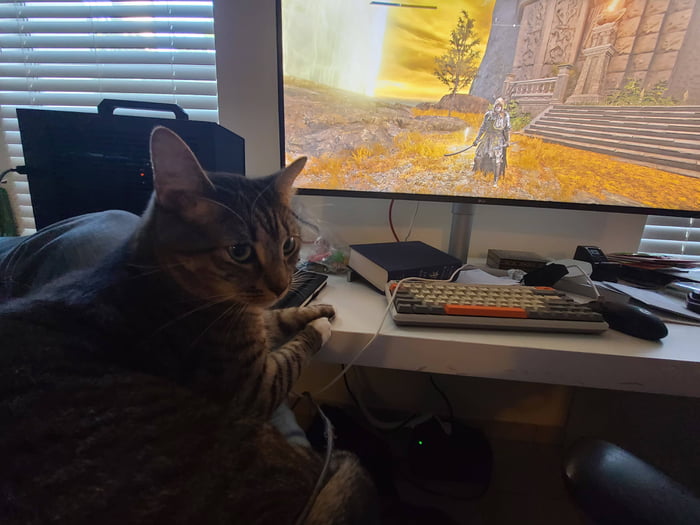
Locate an element on the screen. Image resolution: width=700 pixels, height=525 pixels. dust on cord is located at coordinates (329, 430).